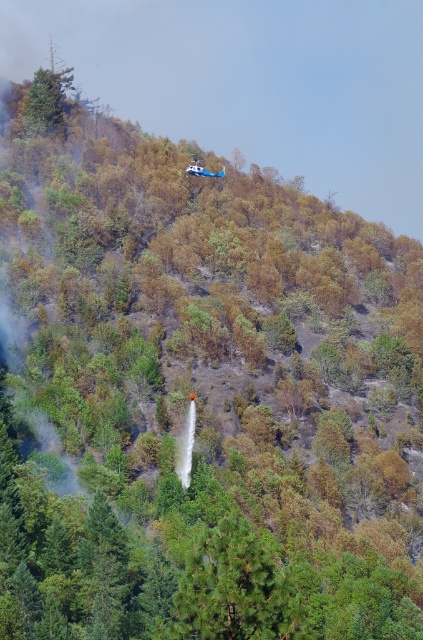
You are a firefighter pilot observing the forest from the helicopter. You need to identify the exact location of the green matte tree at center in the scene. What are its coordinates?

The green matte tree at center is located at coordinates (236,589).

Looking at this image, you are a firefighter observing the forest from a safe distance. You notice two trees in the image, the green matte tree at center and the green matte tree at upper left. Which tree is closer to your vantage point?

The green matte tree at center is closer to your vantage point because it is in front of the green matte tree at upper left.

You are a firefighter assessing the forest area. You notice two trees, the green matte tree at center and the green matte tree at upper left. Which tree is taller?

The green matte tree at upper left is taller than the green matte tree at center.